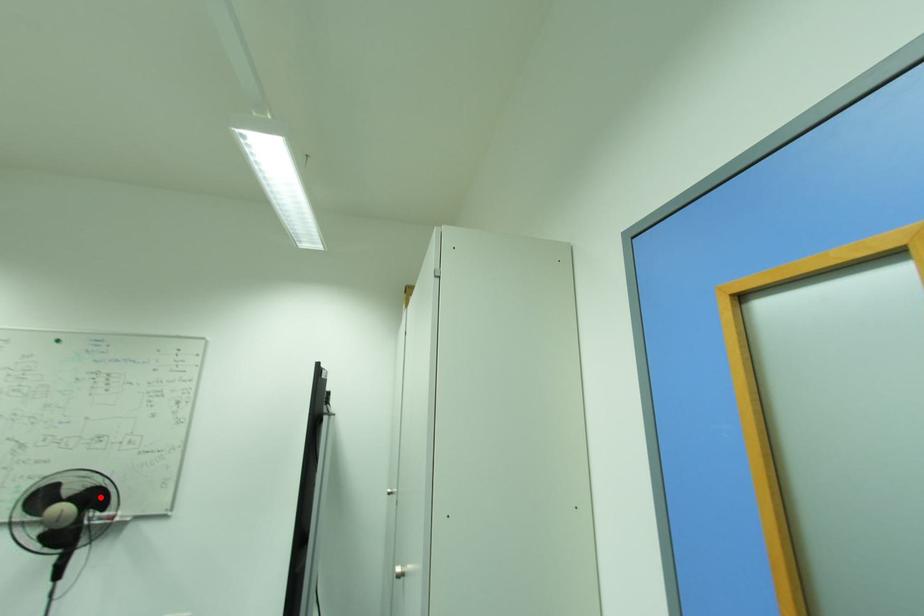
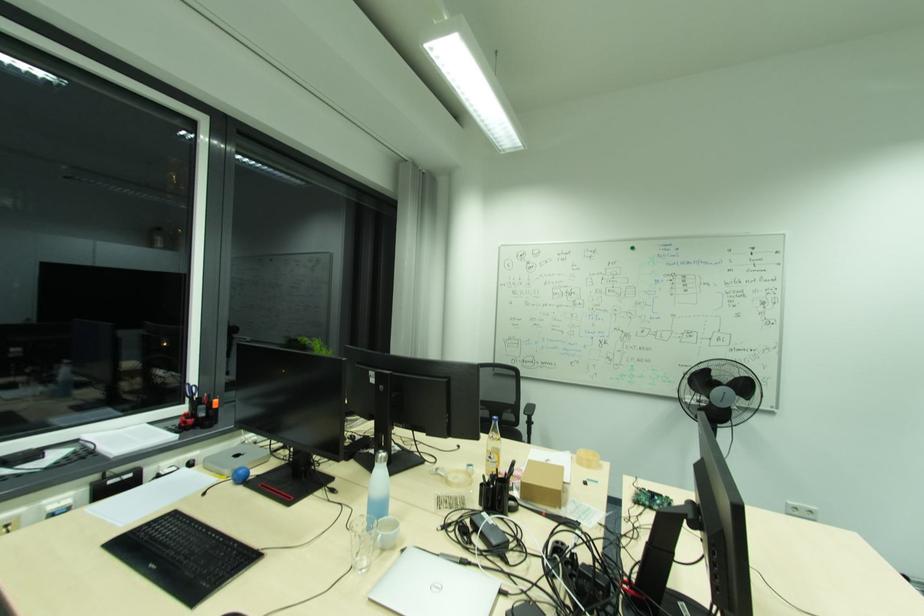
Question: I am providing you with two images of the same scene from different viewpoints. Image1 has a red point marked. In image2, the corresponding 3D location appears at what relative position? Reply with the corresponding letter.

Choices:
 (A) Closer
 (B) Farther

Answer: (B)